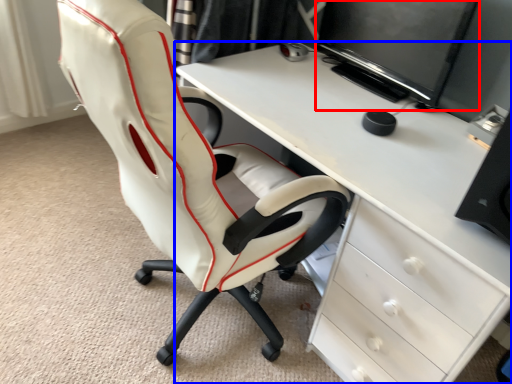
Question: Which of the following is the closest to the observer, computer monitor (highlighted by a red box) or desk (highlighted by a blue box)?

Choices:
 (A) computer monitor
 (B) desk

Answer: (B)